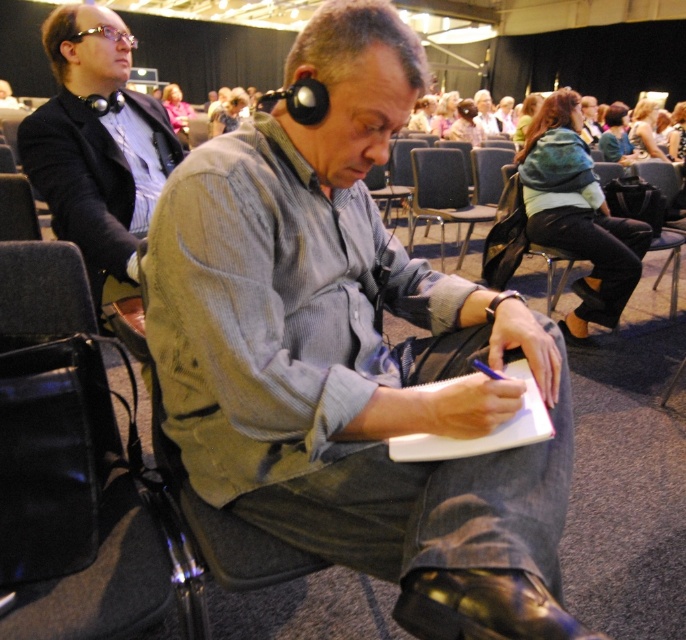
Does black leather bag at lower left appear over matte black headphones at upper left?

No.

Can you confirm if black leather bag at lower left is thinner than matte black headphones at upper left?

Indeed, black leather bag at lower left has a lesser width compared to matte black headphones at upper left.

Identify the location of black leather bag at lower left. Image resolution: width=686 pixels, height=640 pixels. (64, 467).

Can you confirm if matte gray shirt at center is positioned to the right of black leather bag at lower left?

Correct, you'll find matte gray shirt at center to the right of black leather bag at lower left.

Based on the photo, how far apart are matte gray shirt at center and black leather bag at lower left?

They are 30.81 centimeters apart.

At what (x,y) coordinates should I click in order to perform the action: click on matte gray shirt at center. Please return your answer as a coordinate pair (x, y). The image size is (686, 640). Looking at the image, I should click on (353, 353).

Measure the distance between point [425,618] and camera.

27.15 inches

Between matte gray shirt at center and blue fabric chair at center, which one appears on the left side from the viewer's perspective?

From the viewer's perspective, matte gray shirt at center appears more on the left side.

Between point (521, 589) and point (480, 209), which one is positioned in front?

Positioned in front is point (521, 589).

Locate an element on the screen. Image resolution: width=686 pixels, height=640 pixels. matte gray shirt at center is located at coordinates (353, 353).